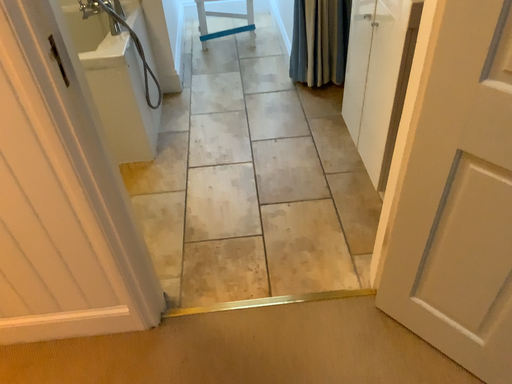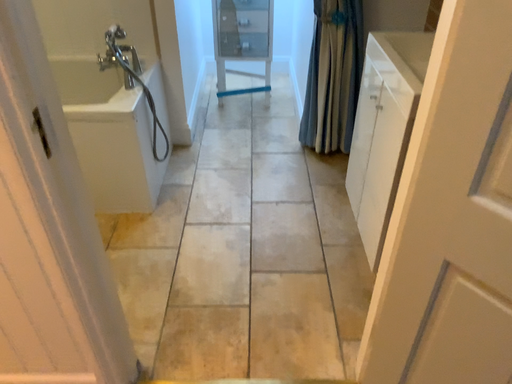
Question: Which way did the camera rotate in the video?

Choices:
 (A) rotated upward
 (B) rotated downward

Answer: (A)